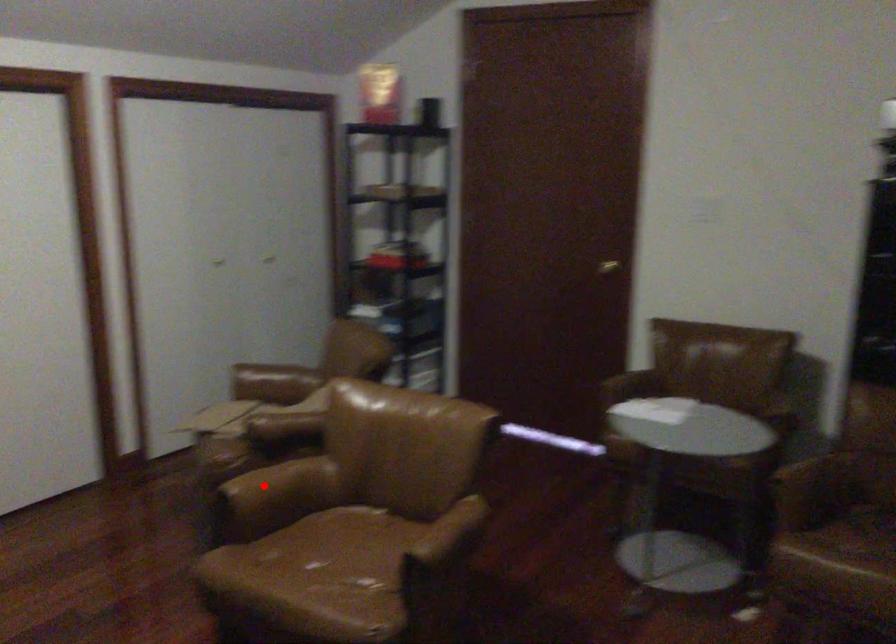
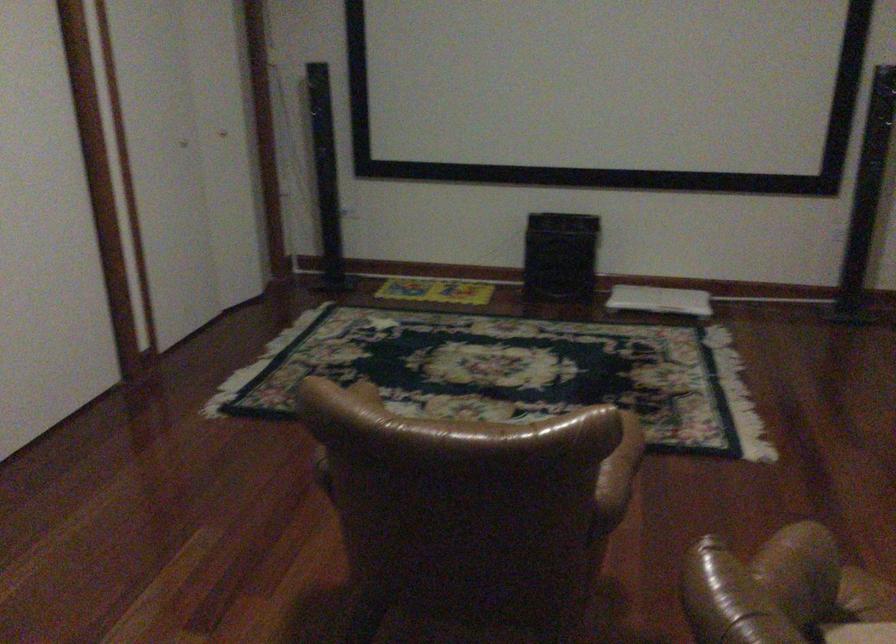
Question: I am providing you with two images of the same scene from different viewpoints. In image1, a red point is highlighted. Considering the same 3D point in image2, which of the following is correct?

Choices:
 (A) It is closer
 (B) It is farther

Answer: (A)